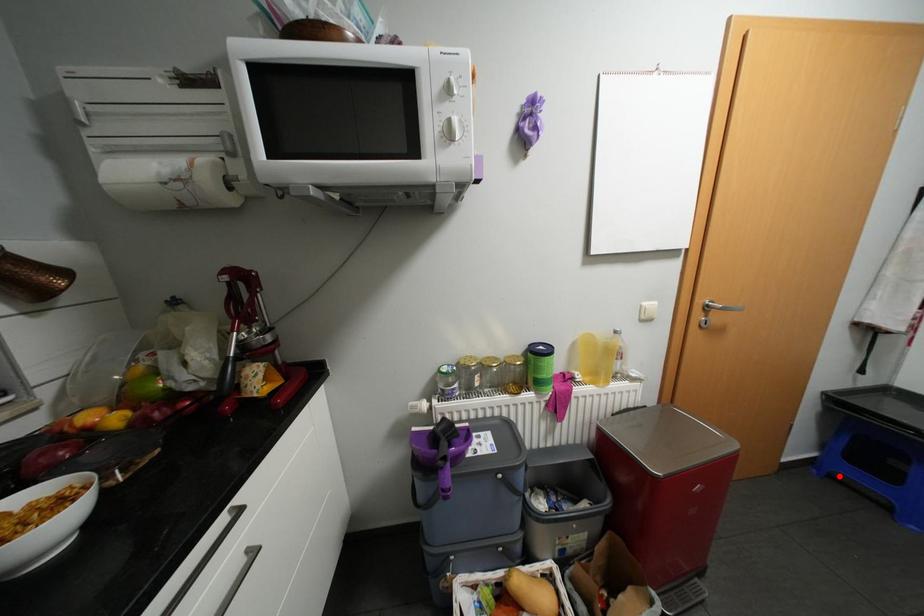
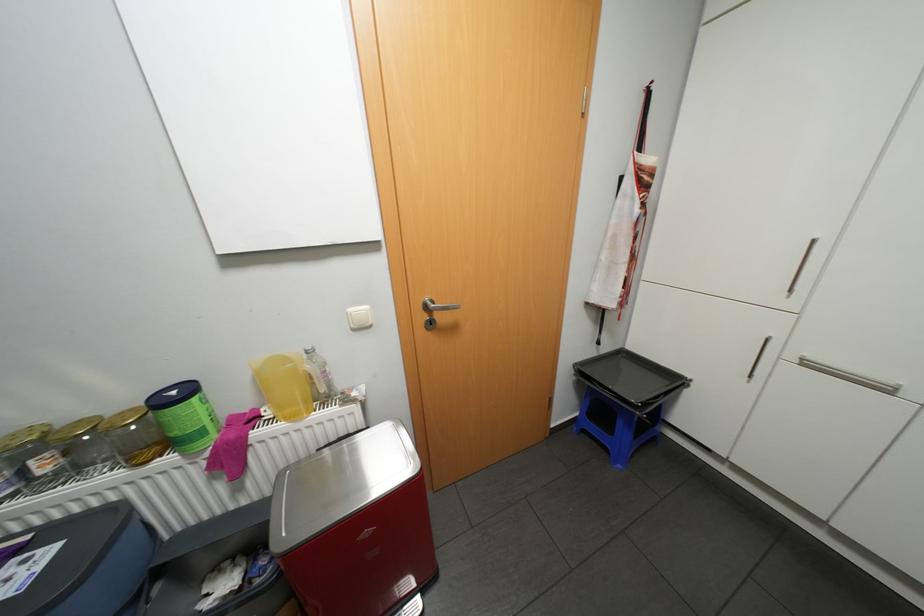
Question: A red point is marked in image1. In image2, is the corresponding 3D point closer to the camera or farther? Reply with the corresponding letter.

Choices:
 (A) The corresponding 3D point is closer.
 (B) The corresponding 3D point is farther.

Answer: (B)